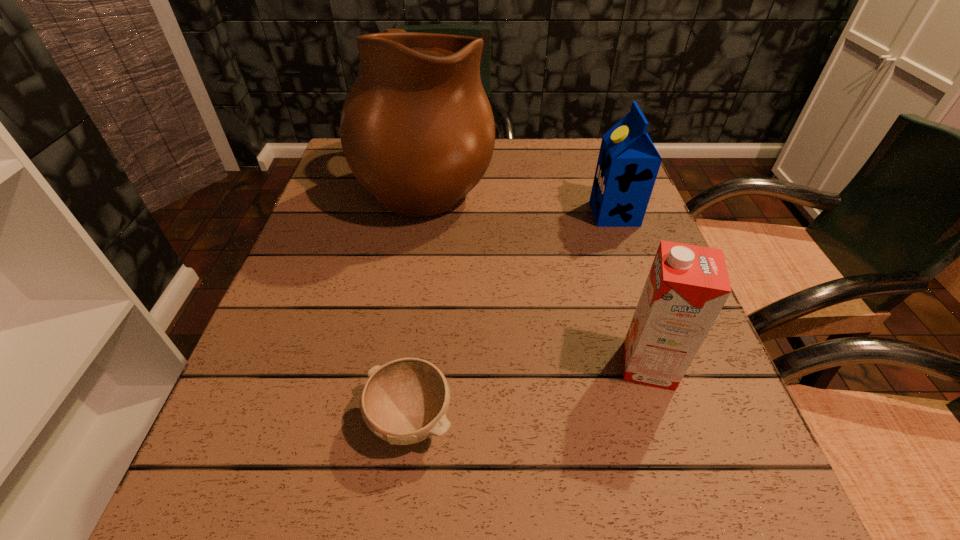
This screenshot has width=960, height=540. I want to click on vacant space that satisfies the following two spatial constraints: 1. at the spout of the cream pitcher; 2. on the back side of the bowl, so click(x=392, y=419).

At what (x,y) coordinates should I click in order to perform the action: click on free location that satisfies the following two spatial constraints: 1. at the spout of the tallest object; 2. on the left side of the bowl. Please return your answer as a coordinate pair (x, y). Looking at the image, I should click on (392, 419).

Where is `vacant area that satisfies the following two spatial constraints: 1. on the back side of the shortest object; 2. at the spout of the cream pitcher`? The height and width of the screenshot is (540, 960). vacant area that satisfies the following two spatial constraints: 1. on the back side of the shortest object; 2. at the spout of the cream pitcher is located at coordinates (439, 183).

You are a GUI agent. You are given a task and a screenshot of the screen. Output one action in this format:
    pyautogui.click(x=<x>, y=<y>)
    Task: Click on the vacant space that satisfies the following two spatial constraints: 1. on the back side of the bowl; 2. at the spout of the cream pitcher
    The image size is (960, 540).
    Given the screenshot: What is the action you would take?
    pyautogui.click(x=439, y=183)

The height and width of the screenshot is (540, 960). Identify the location of vacant position in the image that satisfies the following two spatial constraints: 1. at the spout of the tallest object; 2. on the left side of the bowl. (392, 419).

At what (x,y) coordinates should I click in order to perform the action: click on vacant space that satisfies the following two spatial constraints: 1. at the spout of the nearer carton; 2. on the left side of the cream pitcher. Please return your answer as a coordinate pair (x, y). Looking at the image, I should click on (399, 365).

Locate an element on the screen. This screenshot has width=960, height=540. blank area in the image that satisfies the following two spatial constraints: 1. with the cap open on the farther carton; 2. on the front side of the nearer carton is located at coordinates (668, 365).

What are the coordinates of `blank area in the image that satisfies the following two spatial constraints: 1. at the spout of the cream pitcher; 2. on the back side of the shortest object` in the screenshot? It's located at (392, 419).

Where is `free spot that satisfies the following two spatial constraints: 1. at the spout of the shortest object; 2. on the right side of the cream pitcher`? This screenshot has height=540, width=960. free spot that satisfies the following two spatial constraints: 1. at the spout of the shortest object; 2. on the right side of the cream pitcher is located at coordinates (392, 419).

Where is `vacant point that satisfies the following two spatial constraints: 1. at the spout of the cream pitcher; 2. on the back side of the shortest object`? vacant point that satisfies the following two spatial constraints: 1. at the spout of the cream pitcher; 2. on the back side of the shortest object is located at coordinates (392, 419).